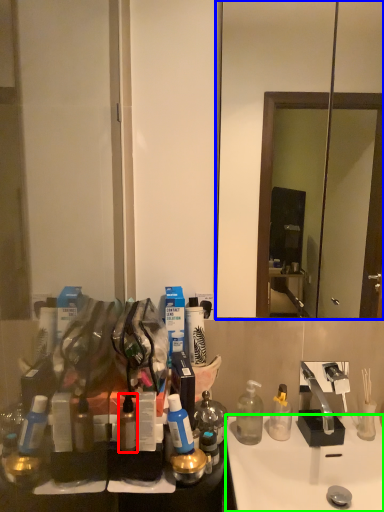
Question: Which is farther away from bottle (highlighted by a red box)? mirror (highlighted by a blue box) or sink (highlighted by a green box)?

Choices:
 (A) mirror
 (B) sink

Answer: (A)